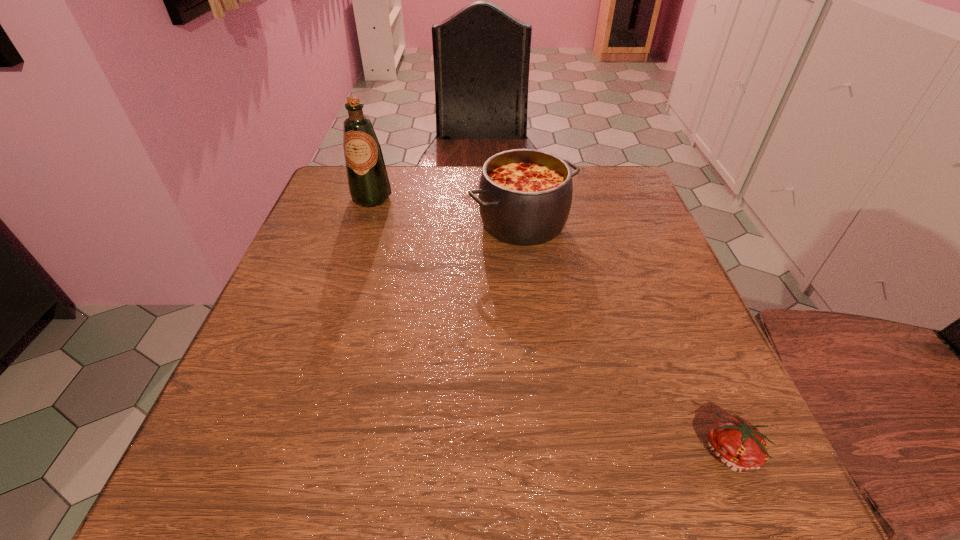
Locate an element on the screen. casserole present at the far edge is located at coordinates (525, 195).

Locate an element on the screen. The image size is (960, 540). object that is at the near edge is located at coordinates (736, 443).

The image size is (960, 540). In order to click on object at the left edge in this screenshot , I will do `click(368, 182)`.

This screenshot has width=960, height=540. I want to click on object at the right edge, so (x=736, y=443).

Locate an element on the screen. object located at the far left corner is located at coordinates (368, 182).

Find the location of a particular element. Image resolution: width=960 pixels, height=540 pixels. object that is positioned at the near right corner is located at coordinates (736, 443).

Find the location of a particular element. This screenshot has height=540, width=960. vacant space at the far edge is located at coordinates (473, 174).

This screenshot has width=960, height=540. In the image, there is a desktop. Identify the location of free space at the near edge. (319, 444).

The height and width of the screenshot is (540, 960). Find the location of `vacant space at the left edge of the desktop`. vacant space at the left edge of the desktop is located at coordinates (337, 283).

The height and width of the screenshot is (540, 960). I want to click on vacant space at the right edge of the desktop, so click(x=605, y=272).